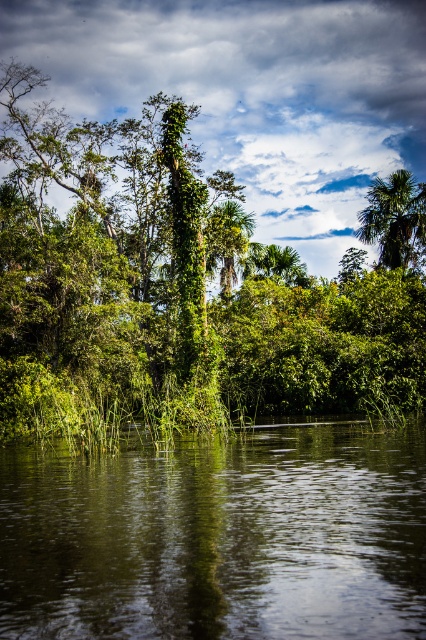
From the picture: Based on the scene description, where is the green reflective water at center located in terms of coordinates?

The green reflective water at center is located at point coordinates of [219,538].

You are standing on the edge of the swamp and see the green reflective water at center and the green leafy palm tree at center. Which object appears taller from your viewpoint?

The green leafy palm tree at center appears taller than the green reflective water at center because the description states that the water has a lesser height compared to the palm tree.